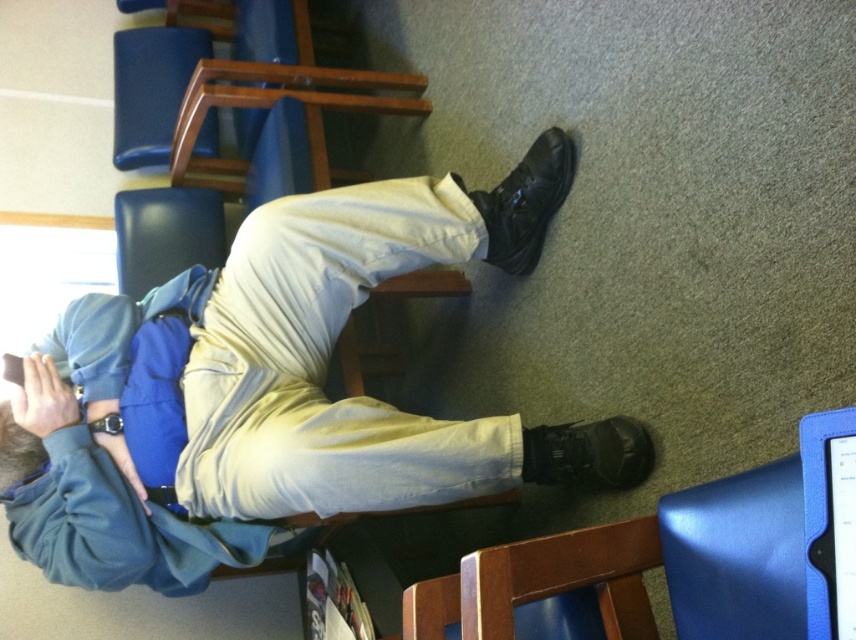
Which of these two, matte black shoe at lower right or matte black hair at lower left, stands shorter?

matte black hair at lower left is shorter.

Consider the image. Which is more to the right, matte black shoe at lower right or matte black hair at lower left?

matte black shoe at lower right

The width and height of the screenshot is (856, 640). What do you see at coordinates (260, 385) in the screenshot? I see `matte black shoe at lower right` at bounding box center [260, 385].

At what (x,y) coordinates should I click in order to perform the action: click on matte black shoe at lower right. Please return your answer as a coordinate pair (x, y). The height and width of the screenshot is (640, 856). Looking at the image, I should click on (260, 385).

Between blue leather tablet at lower right and black leather shoe at lower right, which one has more height?

black leather shoe at lower right is taller.

Image resolution: width=856 pixels, height=640 pixels. I want to click on blue leather tablet at lower right, so click(x=829, y=522).

Does blue leather tablet at lower right lie behind black leather boot at lower center?

No.

Which of these two, blue leather tablet at lower right or black leather boot at lower center, stands shorter?

With less height is black leather boot at lower center.

Describe the element at coordinates (829, 522) in the screenshot. I see `blue leather tablet at lower right` at that location.

The width and height of the screenshot is (856, 640). I want to click on blue leather tablet at lower right, so click(x=829, y=522).